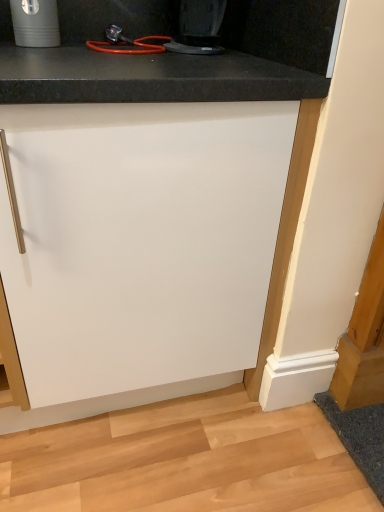
Question: Visually, is black plastic coffee maker at upper center positioned to the left or to the right of white matte cabinet at center?

Choices:
 (A) right
 (B) left

Answer: (A)

Question: Considering the positions of black plastic coffee maker at upper center and white matte cabinet at center in the image, is black plastic coffee maker at upper center taller or shorter than white matte cabinet at center?

Choices:
 (A) tall
 (B) short

Answer: (B)

Question: Which is nearer to the black plastic coffee maker at upper center?

Choices:
 (A) matte black cup at upper left
 (B) white matte cabinet at center

Answer: (A)

Question: Which object is positioned closest to the matte black cup at upper left?

Choices:
 (A) white matte cabinet at center
 (B) black plastic coffee maker at upper center

Answer: (B)